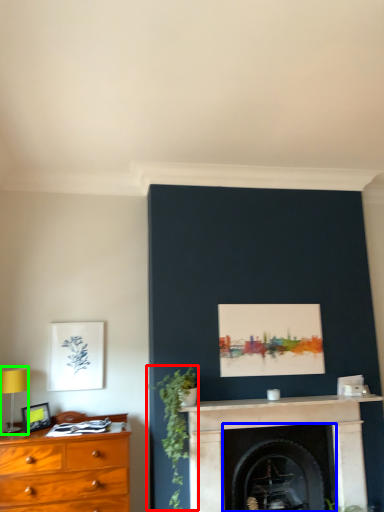
Question: Estimate the real-world distances between objects in this image. Which object is farther from plant (highlighted by a red box), fireplace (highlighted by a blue box) or table lamp (highlighted by a green box)?

Choices:
 (A) fireplace
 (B) table lamp

Answer: (B)